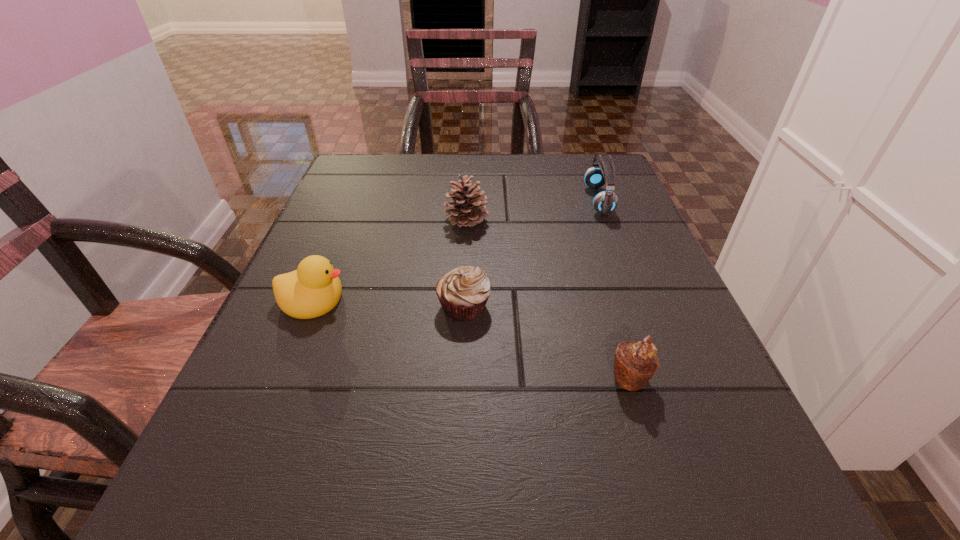
At what (x,y) coordinates should I click in order to perform the action: click on free space that is in between the pinecone and the right muffin. Please return your answer as a coordinate pair (x, y). This screenshot has height=540, width=960. Looking at the image, I should click on (548, 299).

Find the location of `free space between the headset and the duckling`. free space between the headset and the duckling is located at coordinates tap(456, 250).

You are a GUI agent. You are given a task and a screenshot of the screen. Output one action in this format:
    pyautogui.click(x=<x>, y=<y>)
    Task: Click on the vacant area between the duckling and the shorter muffin
    This screenshot has height=540, width=960.
    Given the screenshot: What is the action you would take?
    pyautogui.click(x=389, y=302)

This screenshot has width=960, height=540. I want to click on empty space that is in between the pinecone and the farther muffin, so click(x=466, y=263).

Identify the location of free area in between the duckling and the left muffin. This screenshot has width=960, height=540. (389, 302).

Find the location of a particular element. This screenshot has height=540, width=960. blank region between the nearer muffin and the headset is located at coordinates (614, 289).

What are the coordinates of `object that is the closest one to the shorter muffin` in the screenshot? It's located at (314, 289).

Find the location of a particular element. This screenshot has width=960, height=540. the fourth closest object to the shorter muffin is located at coordinates (605, 202).

Find the location of a particular element. vacant area in the image that satisfies the following two spatial constraints: 1. on the front side of the pinecone; 2. on the left side of the left muffin is located at coordinates (464, 306).

At what (x,y) coordinates should I click in order to perform the action: click on free spot that satisfies the following two spatial constraints: 1. on the face of the right muffin; 2. on the left side of the leftmost object. Please return your answer as a coordinate pair (x, y). The height and width of the screenshot is (540, 960). Looking at the image, I should click on (281, 378).